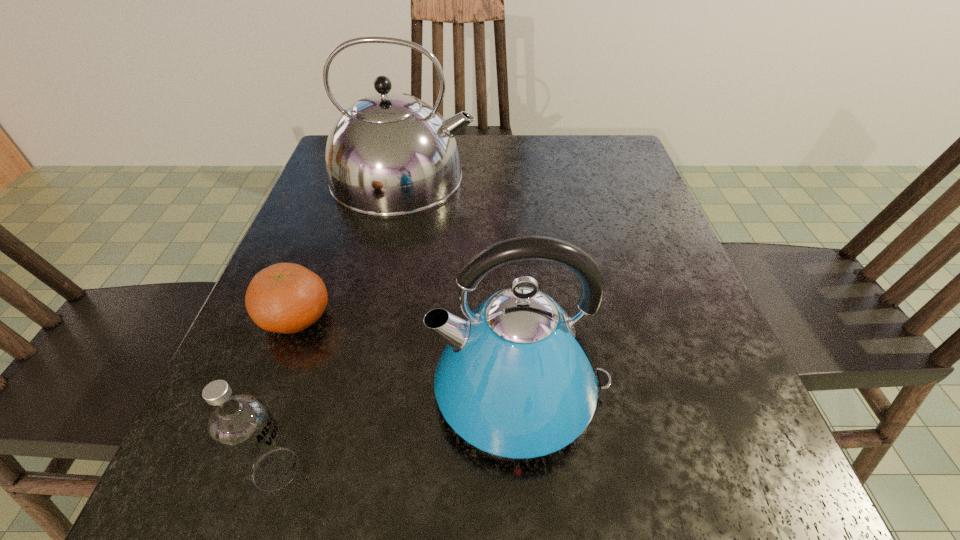
Find the location of a particular element. The height and width of the screenshot is (540, 960). the farther kettle is located at coordinates point(389,154).

Where is `the nearer kettle`? the nearer kettle is located at coordinates (516, 379).

Find the location of a particular element. The image size is (960, 540). vodka is located at coordinates (241, 426).

Where is `clementine`? clementine is located at coordinates (288, 298).

The image size is (960, 540). What are the coordinates of `vacant point located 0.300m from the spout of the farthest object` in the screenshot? It's located at click(605, 177).

Locate an element on the screen. This screenshot has height=540, width=960. free space located at the spout of the nearer kettle is located at coordinates (307, 390).

Locate an element on the screen. The height and width of the screenshot is (540, 960). vacant space located 0.200m at the spout of the nearer kettle is located at coordinates (293, 390).

Find the location of `free space located 0.100m at the spout of the nearer kettle`. free space located 0.100m at the spout of the nearer kettle is located at coordinates (363, 390).

You are a GUI agent. You are given a task and a screenshot of the screen. Output one action in this format:
    pyautogui.click(x=<x>, y=<y>)
    Task: Click on the free space located on the front label of the vodka
    The width and height of the screenshot is (960, 540).
    Given the screenshot: What is the action you would take?
    tap(444, 470)

Identify the location of vacant space situated 0.120m on the front of the clementine. This screenshot has height=540, width=960. (257, 418).